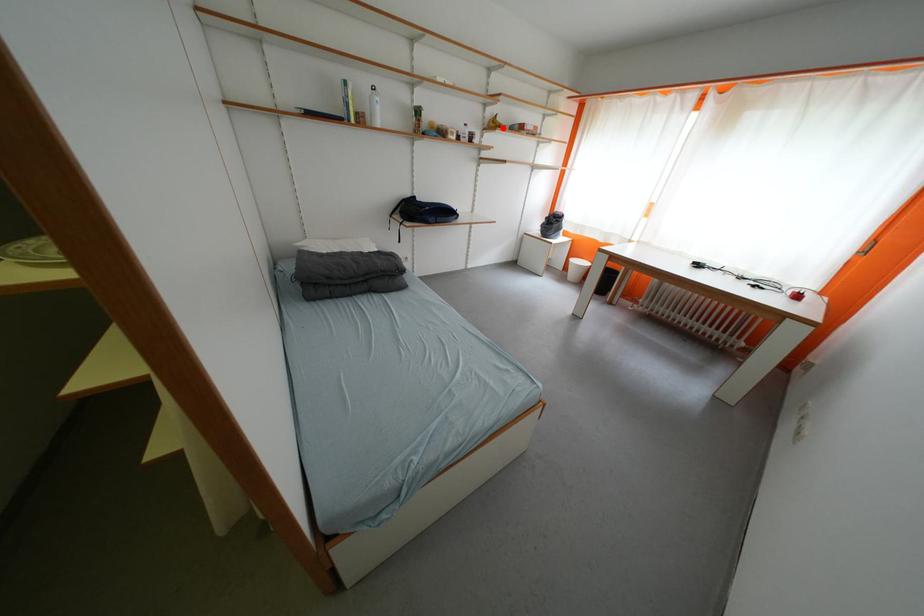
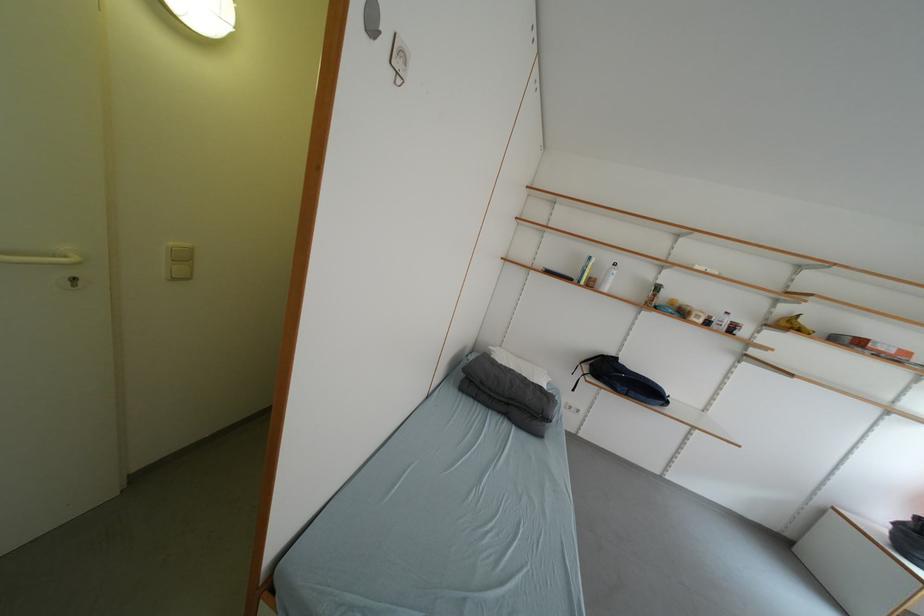
Question: I am providing you with two images of the same scene from different viewpoints. A red point is marked on the first image. At the location where the point appears in image 1, is it still visible in image 2?

Choices:
 (A) Yes
 (B) No

Answer: (A)